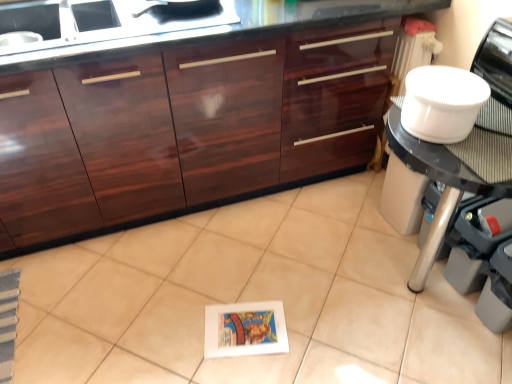
Question: Is glossy wood cabinetry at center positioned in front of white glossy tile at center?

Choices:
 (A) yes
 (B) no

Answer: (B)

Question: Considering the relative sizes of glossy wood cabinetry at center and white glossy tile at center in the image provided, is glossy wood cabinetry at center bigger than white glossy tile at center?

Choices:
 (A) no
 (B) yes

Answer: (B)

Question: Considering the relative positions of glossy wood cabinetry at center and white glossy tile at center in the image provided, is glossy wood cabinetry at center behind white glossy tile at center?

Choices:
 (A) no
 (B) yes

Answer: (B)

Question: Is white glossy tile at center inside glossy wood cabinetry at center?

Choices:
 (A) no
 (B) yes

Answer: (A)

Question: From the image's perspective, is glossy wood cabinetry at center over white glossy tile at center?

Choices:
 (A) no
 (B) yes

Answer: (B)

Question: Considering the positions of white plastic bowl at right and white paper book at center in the image, is white plastic bowl at right taller or shorter than white paper book at center?

Choices:
 (A) tall
 (B) short

Answer: (A)

Question: Would you say white plastic bowl at right is inside or outside white paper book at center?

Choices:
 (A) outside
 (B) inside

Answer: (A)

Question: Considering the positions of white plastic bowl at right and white paper book at center in the image, is white plastic bowl at right bigger or smaller than white paper book at center?

Choices:
 (A) small
 (B) big

Answer: (B)

Question: From the image's perspective, relative to white paper book at center, is white plastic bowl at right above or below?

Choices:
 (A) below
 (B) above

Answer: (B)

Question: Considering the positions of white plastic bowl at upper right and white paper book at center in the image, is white plastic bowl at upper right bigger or smaller than white paper book at center?

Choices:
 (A) small
 (B) big

Answer: (B)

Question: Looking at their shapes, would you say white plastic bowl at upper right is wider or thinner than white paper book at center?

Choices:
 (A) wide
 (B) thin

Answer: (B)

Question: Would you say white plastic bowl at upper right is inside or outside white paper book at center?

Choices:
 (A) outside
 (B) inside

Answer: (A)

Question: From a real-world perspective, relative to white paper book at center, is white plastic bowl at upper right vertically above or below?

Choices:
 (A) above
 (B) below

Answer: (A)

Question: Would you say white plastic bowl at upper right is inside or outside white plastic bowl at right?

Choices:
 (A) outside
 (B) inside

Answer: (A)

Question: In the image, is white plastic bowl at upper right positioned in front of or behind white plastic bowl at right?

Choices:
 (A) behind
 (B) front

Answer: (A)